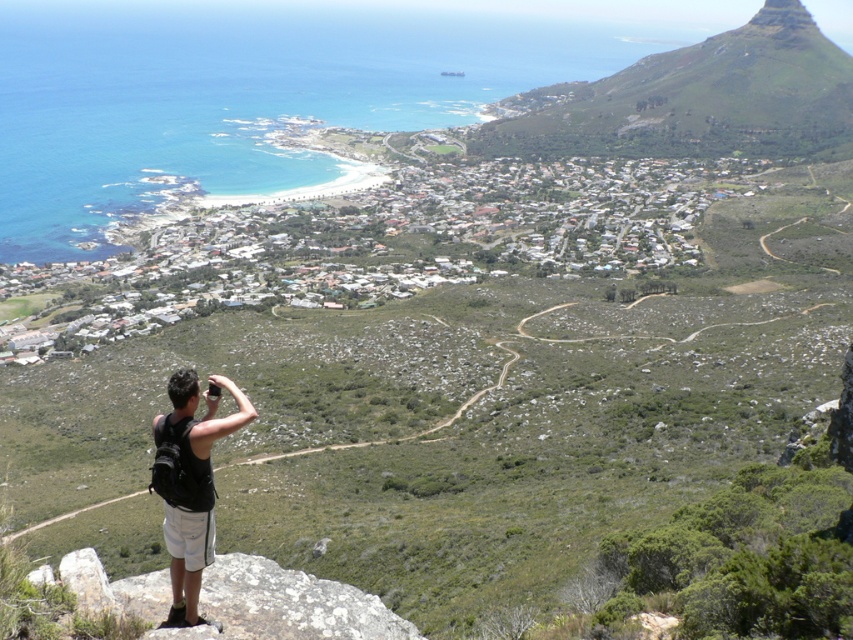
Who is more distant from viewer, (688, 108) or (173, 534)?

Positioned behind is point (688, 108).

You are a GUI agent. You are given a task and a screenshot of the screen. Output one action in this format:
    pyautogui.click(x=<x>, y=<y>)
    Task: Click on the green grassy mountain at upper right
    This screenshot has height=640, width=853.
    Given the screenshot: What is the action you would take?
    pyautogui.click(x=695, y=99)

Is point (805, 76) in front of point (183, 513)?

No.

The image size is (853, 640). Identify the location of green grassy mountain at upper right. (695, 99).